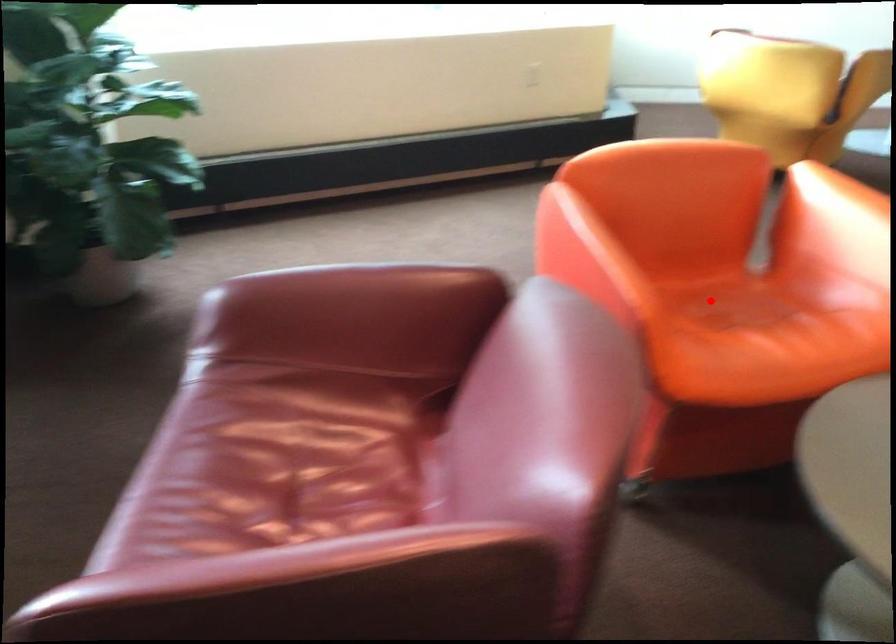
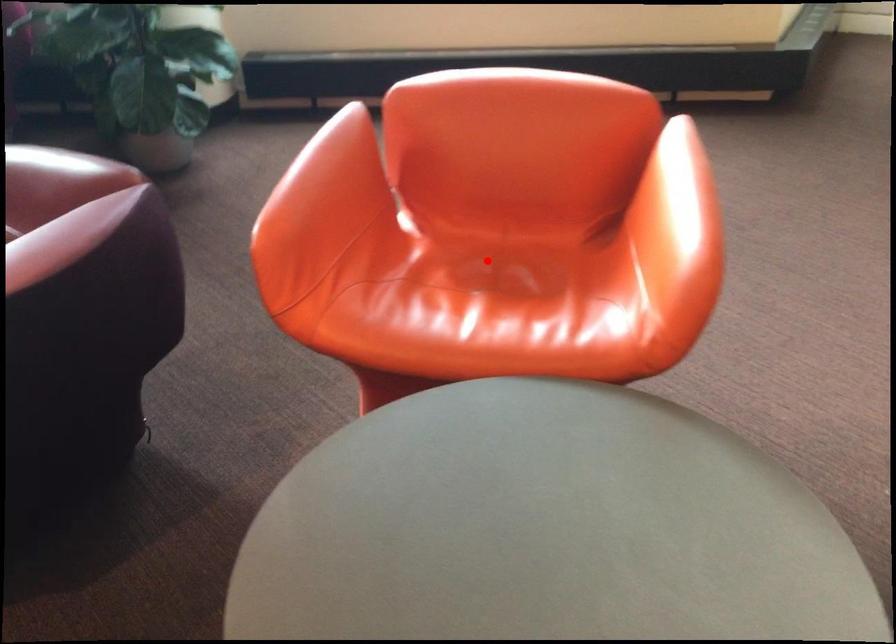
I am providing you with two images of the same scene from different viewpoints. A red point is marked on the first image and another point is marked on the second image. Are the points marked in image1 and image2 representing the same 3D position?

Yes